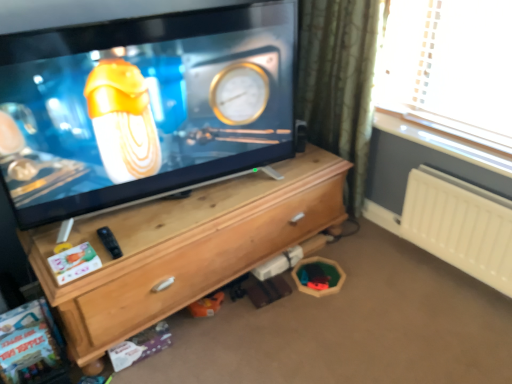
Question: Can you confirm if matte black tv at center is thinner than white plastic radiator at right?

Choices:
 (A) yes
 (B) no

Answer: (B)

Question: From the image's perspective, is matte black tv at center beneath white plastic radiator at right?

Choices:
 (A) yes
 (B) no

Answer: (B)

Question: Could you tell me if matte black tv at center is turned towards white plastic radiator at right?

Choices:
 (A) yes
 (B) no

Answer: (B)

Question: Are matte black tv at center and white plastic radiator at right far apart?

Choices:
 (A) no
 (B) yes

Answer: (B)

Question: Can you confirm if matte black tv at center is positioned to the right of white plastic radiator at right?

Choices:
 (A) no
 (B) yes

Answer: (A)

Question: Can we say matte black tv at center lies outside white plastic radiator at right?

Choices:
 (A) no
 (B) yes

Answer: (B)

Question: From a real-world perspective, does white plastic radiator at right sit lower than green textured curtain at upper right?

Choices:
 (A) yes
 (B) no

Answer: (A)

Question: Is white plastic radiator at right smaller than green textured curtain at upper right?

Choices:
 (A) no
 (B) yes

Answer: (B)

Question: Is green textured curtain at upper right completely or partially inside white plastic radiator at right?

Choices:
 (A) no
 (B) yes

Answer: (A)

Question: Is white plastic radiator at right taller than green textured curtain at upper right?

Choices:
 (A) yes
 (B) no

Answer: (B)

Question: Is white plastic radiator at right positioned with its back to green textured curtain at upper right?

Choices:
 (A) no
 (B) yes

Answer: (A)

Question: From a real-world perspective, is white plastic radiator at right over green textured curtain at upper right?

Choices:
 (A) yes
 (B) no

Answer: (B)

Question: Are green textured curtain at upper right and white plastic radiator at right making contact?

Choices:
 (A) no
 (B) yes

Answer: (A)